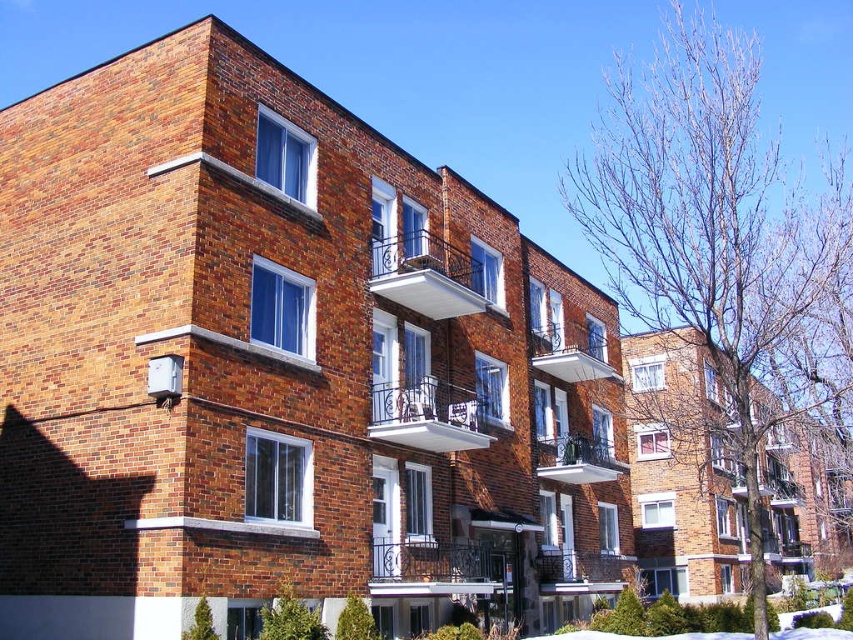
You are an architect reviewing the building facade. You notice the metallic silver balcony at center and the white matte balcony at upper center. Which balcony is positioned lower on the building?

The metallic silver balcony at center is positioned lower on the building than the white matte balcony at upper center.

You are an architect designing a new balcony for the building. You have two existing examples to consider. Which balcony has a greater width between the two, the metallic silver balcony at center and the white matte balcony at upper center?

The white matte balcony at upper center has a greater width than the metallic silver balcony at center.

Consider the image. You are standing in front of the brick apartment buildings and notice a specific point marked on the facade. Based on the coordinates given, can you identify which architectural feature is located at point (433, 568)?

The point (433, 568) marks the location of the rustic wrought iron balcony at center.